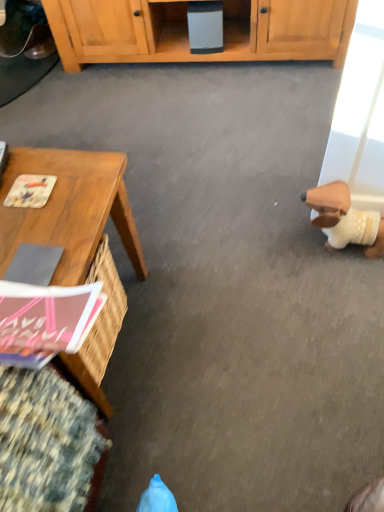
You are a GUI agent. You are given a task and a screenshot of the screen. Output one action in this format:
    pyautogui.click(x=<x>, y=<y>)
    Task: Click on the vacant space to the right of wooden desk at left
    This screenshot has width=384, height=512.
    Given the screenshot: What is the action you would take?
    pyautogui.click(x=218, y=320)